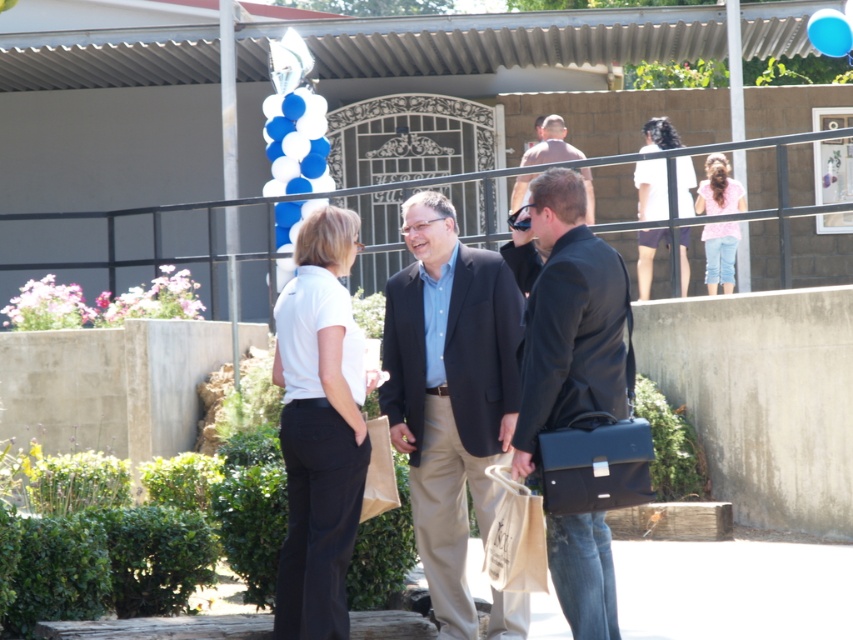
You are a photographer at this event and need to capture a photo of both the matte black suit at center and the matte black briefcase at center in the same frame. The camera you are using has a minimum focus distance of 30 inches. Will you be able to focus on both objects clearly?

The matte black suit at center is 35.62 inches from the matte black briefcase at center. Since the camera requires a minimum focus distance of 30 inches, the distance between them is sufficient for both objects to be in focus. Therefore, you can capture both clearly in the same frame.

You are standing at the event and want to approach the matte black suit at center to greet them. If your walking speed is 1.2 meters per second, approximately how many seconds will it take you to reach them?

The distance between you and the matte black suit at center is 9.58 meters. At a walking speed of 1.2 meters per second, dividing the distance by speed gives approximately 8 seconds to reach them.